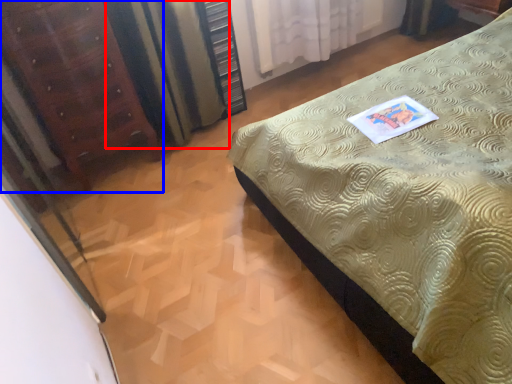
Question: Among these objects, which one is nearest to the camera, curtain (highlighted by a red box) or furniture (highlighted by a blue box)?

Choices:
 (A) curtain
 (B) furniture

Answer: (B)